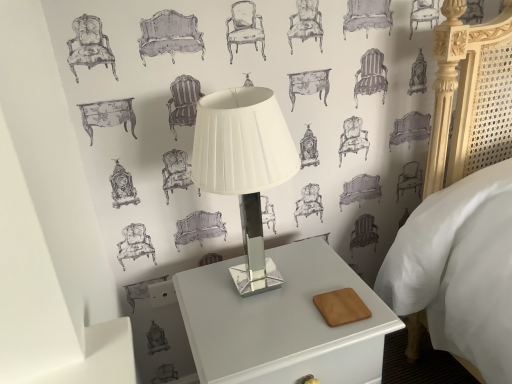
This screenshot has width=512, height=384. In order to click on spots to the right of white glossy table lamp at center in this screenshot , I will do `click(335, 284)`.